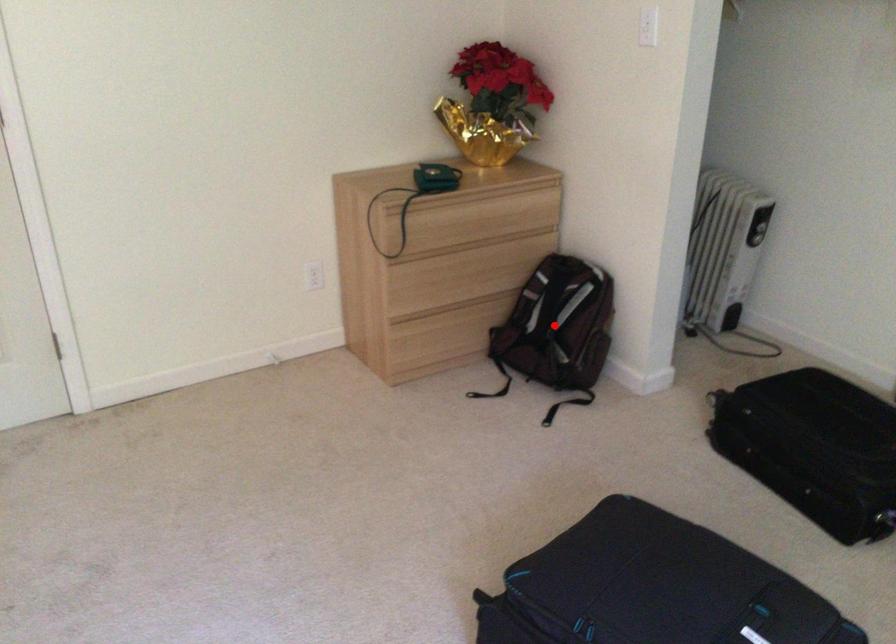
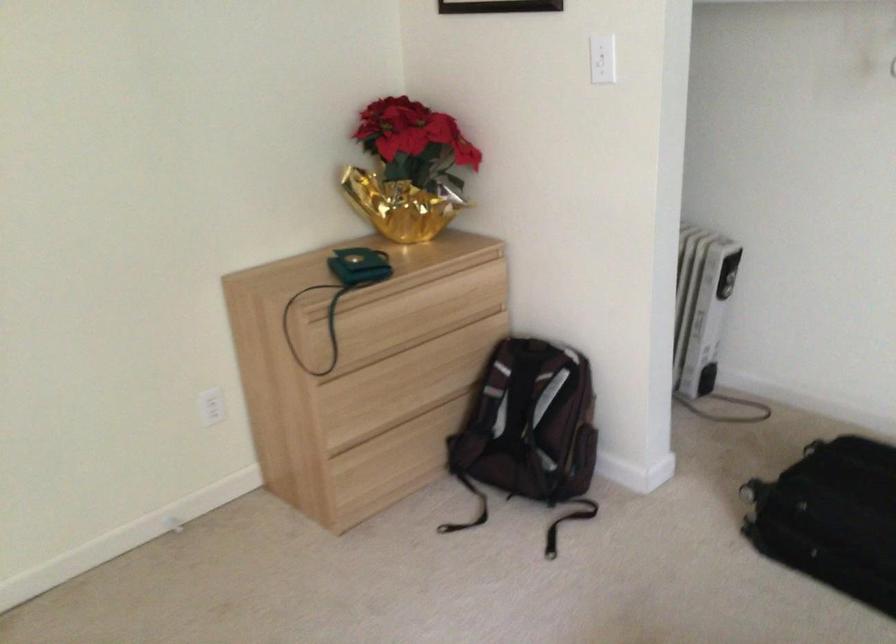
Where in the second image is the point corresponding to the highlighted location from the first image?

(531, 427)